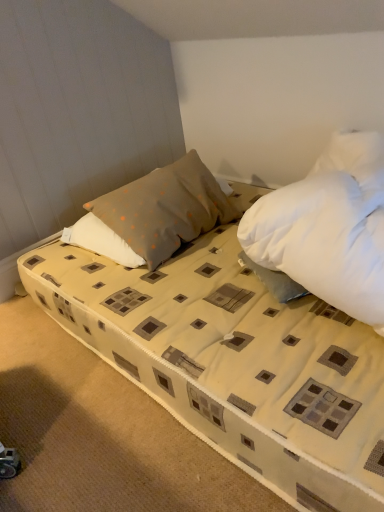
Question: From the image's perspective, is gray dotted pillow at center positioned above or below beige fabric bed at center?

Choices:
 (A) above
 (B) below

Answer: (A)

Question: In the image, is gray dotted pillow at center on the left side or the right side of beige fabric bed at center?

Choices:
 (A) left
 (B) right

Answer: (A)

Question: In terms of height, does gray dotted pillow at center look taller or shorter compared to beige fabric bed at center?

Choices:
 (A) short
 (B) tall

Answer: (B)

Question: From their relative heights in the image, would you say beige fabric bed at center is taller or shorter than gray dotted pillow at center?

Choices:
 (A) tall
 (B) short

Answer: (B)

Question: Does point (377, 417) appear closer or farther from the camera than point (210, 198)?

Choices:
 (A) farther
 (B) closer

Answer: (B)

Question: Would you say beige fabric bed at center is to the left or to the right of gray dotted pillow at center in the picture?

Choices:
 (A) left
 (B) right

Answer: (B)

Question: Considering the positions of beige fabric bed at center and gray dotted pillow at center in the image, is beige fabric bed at center bigger or smaller than gray dotted pillow at center?

Choices:
 (A) small
 (B) big

Answer: (B)